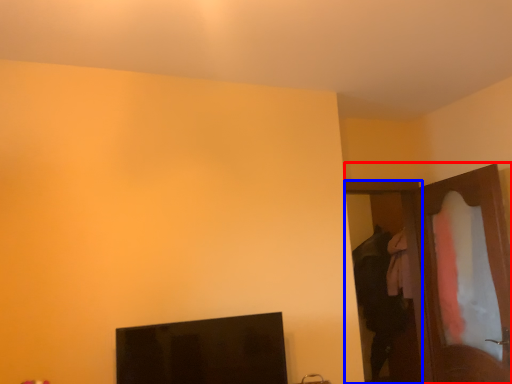
Question: Which point is closer to the camera, dresser (highlighted by a red box) or door (highlighted by a blue box)?

Choices:
 (A) dresser
 (B) door

Answer: (A)